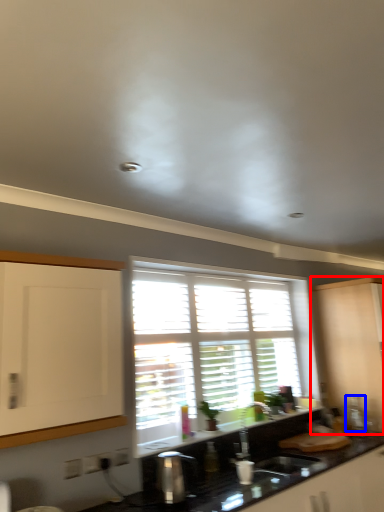
Question: Which of the following is the closest to the observer, cabinetry (highlighted by a red box) or appliance (highlighted by a blue box)?

Choices:
 (A) cabinetry
 (B) appliance

Answer: (A)